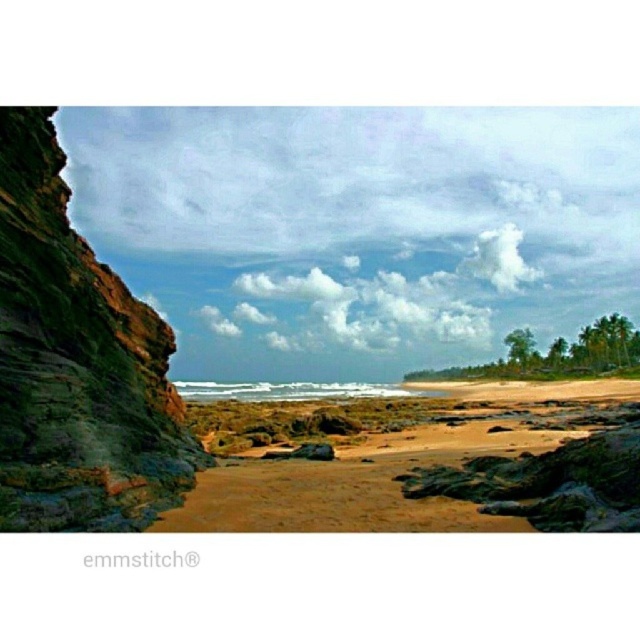
Question: Among these points, which one is farthest from the camera?

Choices:
 (A) (472, 483)
 (B) (60, 224)

Answer: (B)

Question: Which object is farther from the camera taking this photo?

Choices:
 (A) green mossy rock at left
 (B) brown sandy beach at center

Answer: (B)

Question: Does green mossy rock at left appear under brown sandy beach at center?

Choices:
 (A) yes
 (B) no

Answer: (B)

Question: Is green mossy rock at left positioned before brown sandy beach at center?

Choices:
 (A) no
 (B) yes

Answer: (B)

Question: Is green mossy rock at left to the left of brown sandy beach at center from the viewer's perspective?

Choices:
 (A) yes
 (B) no

Answer: (A)